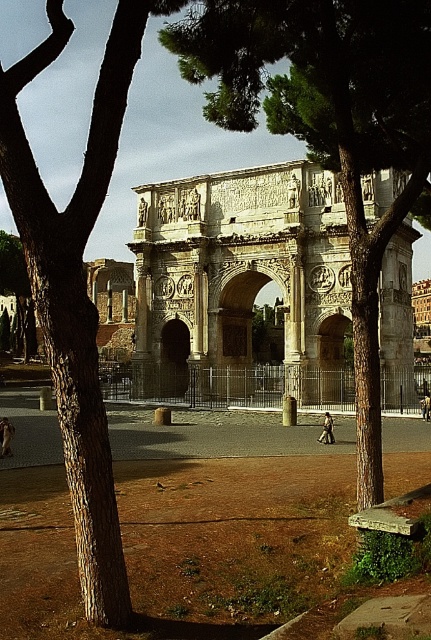
Who is lower down, green leafy tree at center or brown rough tree at left?

green leafy tree at center is below.

Does green leafy tree at center lie behind brown rough tree at left?

Yes.

Describe the element at coordinates (328, 128) in the screenshot. I see `green leafy tree at center` at that location.

Locate an element on the screen. green leafy tree at center is located at coordinates (328, 128).